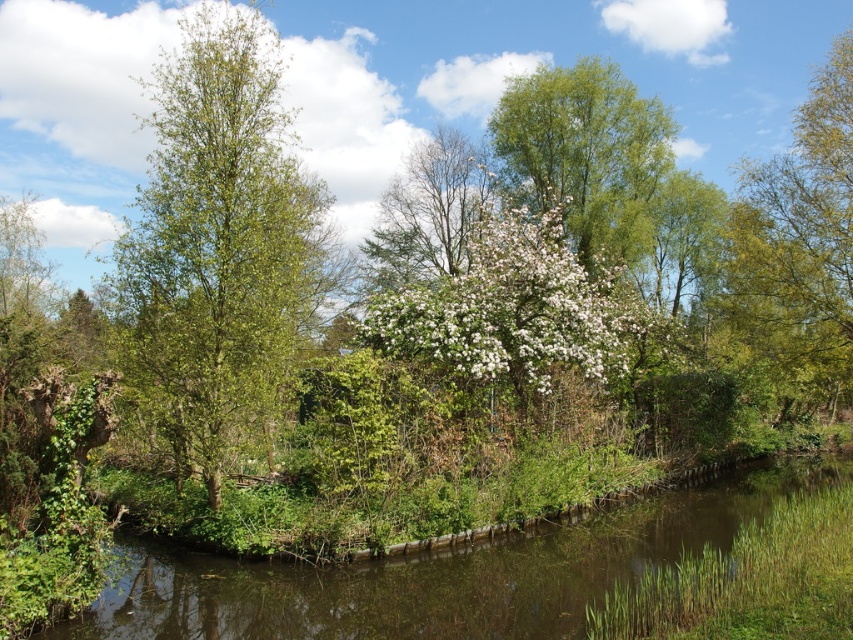
Can you confirm if green leafy tree at left is taller than white blossoming tree at center?

Yes, green leafy tree at left is taller than white blossoming tree at center.

Which is more to the left, green leafy tree at left or white blossoming tree at center?

green leafy tree at left

Between point (276, 356) and point (395, 234), which one is positioned behind?

The point (395, 234) is more distant.

Identify the location of green leafy tree at left. This screenshot has width=853, height=640. (218, 243).

Does green grassy river at lower center appear on the right side of green leafy tree at upper center?

Incorrect, green grassy river at lower center is not on the right side of green leafy tree at upper center.

Is green grassy river at lower center bigger than green leafy tree at upper center?

No, green grassy river at lower center is not bigger than green leafy tree at upper center.

Does point (344, 580) come behind point (509, 93)?

No, (344, 580) is in front of (509, 93).

Locate an element on the screen. The height and width of the screenshot is (640, 853). green grassy river at lower center is located at coordinates (439, 573).

Who is taller, green grassy river at lower center or white blossoming tree at center?

With more height is green grassy river at lower center.

Does green grassy river at lower center have a greater height compared to white blossoming tree at center?

Indeed, green grassy river at lower center has a greater height compared to white blossoming tree at center.

Measure the distance between point (155, 588) and camera.

Point (155, 588) is 34.66 feet away from camera.

Where is `green grassy river at lower center`? The image size is (853, 640). green grassy river at lower center is located at coordinates (439, 573).